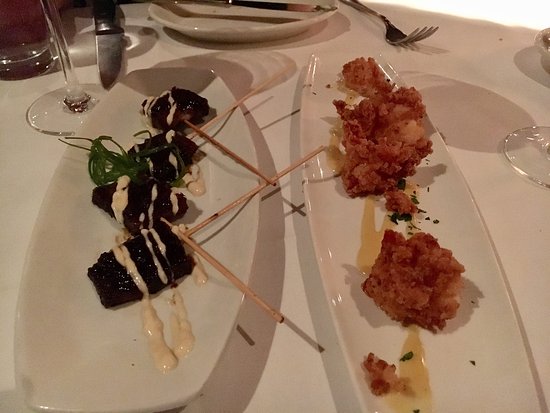
Find the location of `base of champagne glass`. base of champagne glass is located at coordinates (53, 120), (530, 148).